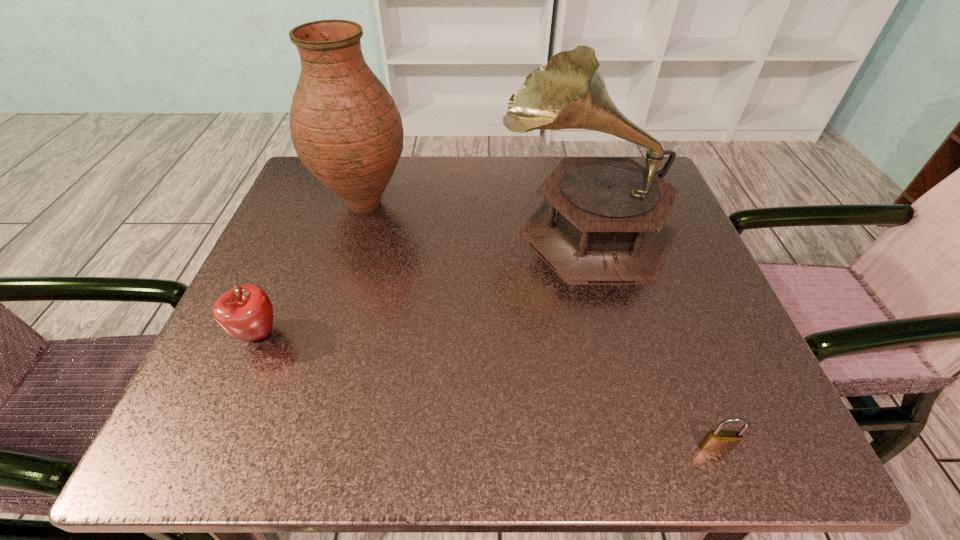
You are a GUI agent. You are given a task and a screenshot of the screen. Output one action in this format:
    pyautogui.click(x=<x>, y=<y>)
    Task: Click on the object positioned at the far right corner
    
    Given the screenshot: What is the action you would take?
    pyautogui.click(x=603, y=219)

I want to click on object situated at the near right corner, so click(716, 441).

Where is `blank area at the far edge`? blank area at the far edge is located at coordinates (514, 174).

At what (x,y) coordinates should I click in order to perform the action: click on vacant region at the near edge of the desktop. Please return your answer as a coordinate pair (x, y). Image resolution: width=960 pixels, height=540 pixels. Looking at the image, I should click on (327, 447).

Where is `free space at the right edge`? free space at the right edge is located at coordinates (687, 294).

The image size is (960, 540). Find the location of `vacant space at the far left corner of the desktop`. vacant space at the far left corner of the desktop is located at coordinates (345, 212).

You are a GUI agent. You are given a task and a screenshot of the screen. Output one action in this format:
    pyautogui.click(x=<x>, y=<y>)
    Task: Click on the free space between the apple and the phonograph record
    
    Given the screenshot: What is the action you would take?
    pyautogui.click(x=422, y=280)

The width and height of the screenshot is (960, 540). Identify the location of vacant area that lies between the nearest object and the third farthest object. (487, 391).

Locate an element on the screen. The image size is (960, 540). free space between the nearest object and the phonograph record is located at coordinates (651, 336).

Locate an element on the screen. free space between the second shortest object and the phonograph record is located at coordinates (422, 280).